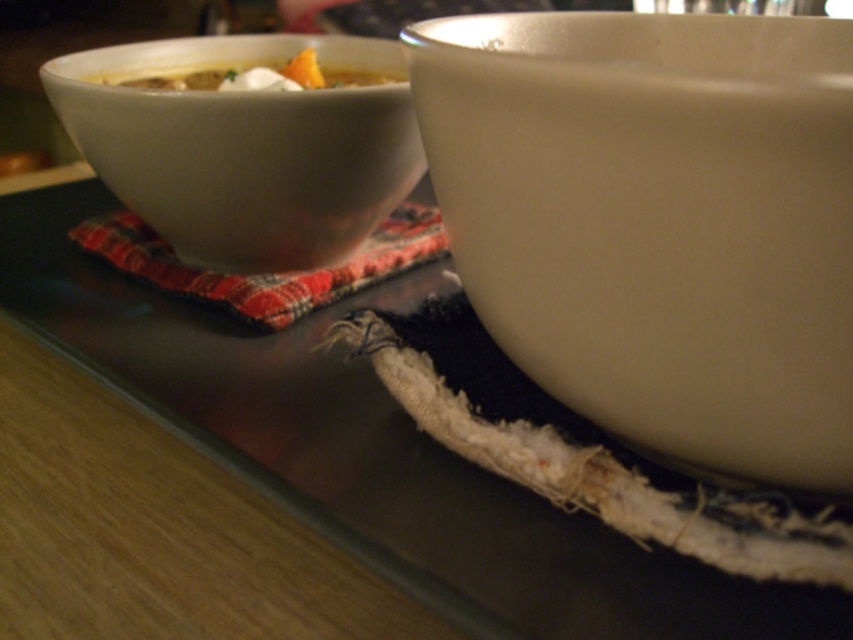
You are arranging dishes on a tray and need to place a new bowl between the red plaid cloth at upper left and the yellow matte soup at upper left. Can you fit it there without overlapping either?

The red plaid cloth at upper left is further to the viewer than the yellow matte soup at upper left, so there is space between them to place the new bowl without overlapping either.

You are arranging a dining table and need to place the red plaid cloth at upper left and the yellow matte soup at upper left correctly. According to the scene, which object is positioned to the left of the other?

The yellow matte soup at upper left is to the left of the red plaid cloth at upper left because the red plaid cloth at upper left is positioned to the right of the yellow matte soup at upper left.